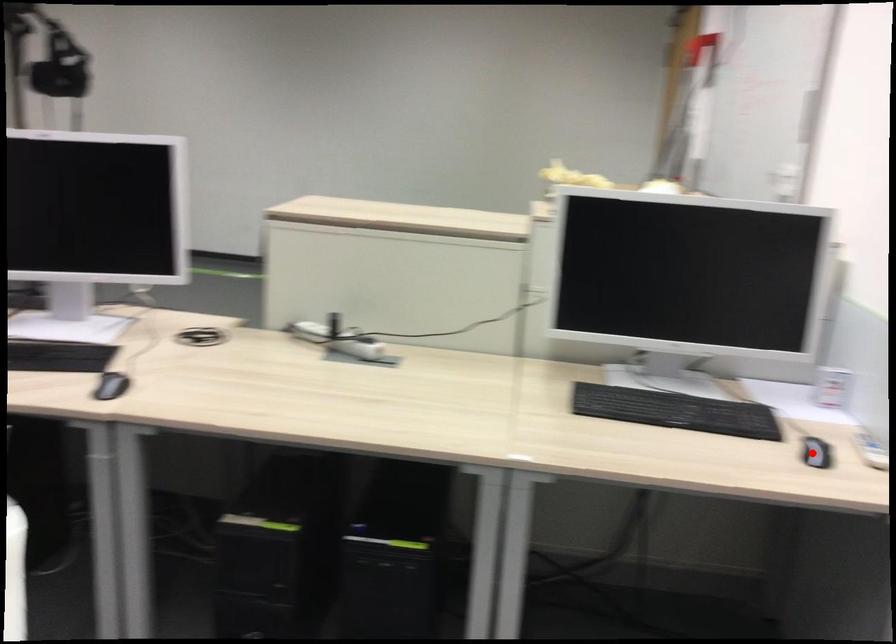
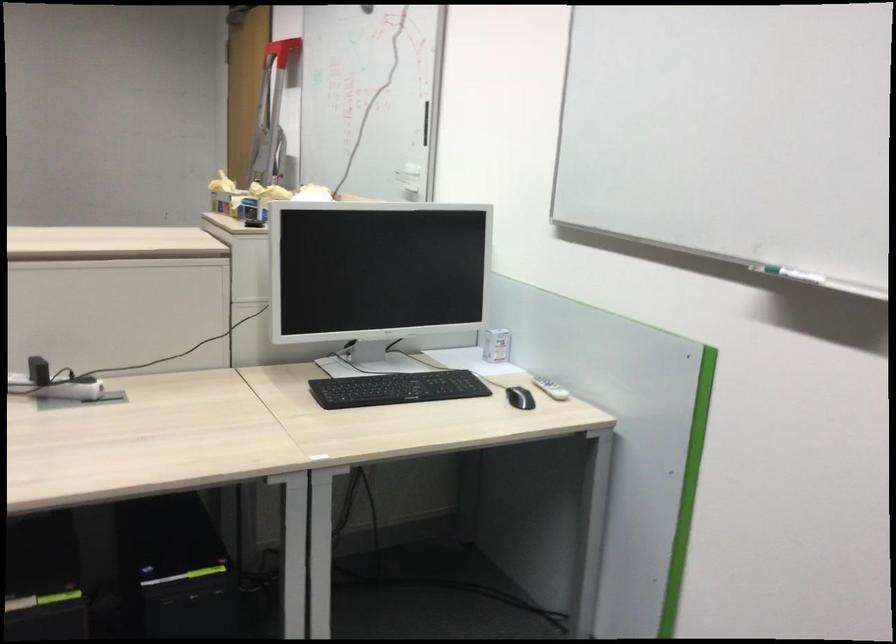
Question: I am providing you with two images of the same scene from different viewpoints. In image1, a red point is highlighted. Considering the same 3D point in image2, which of the following is correct?

Choices:
 (A) It is closer
 (B) It is farther

Answer: (B)